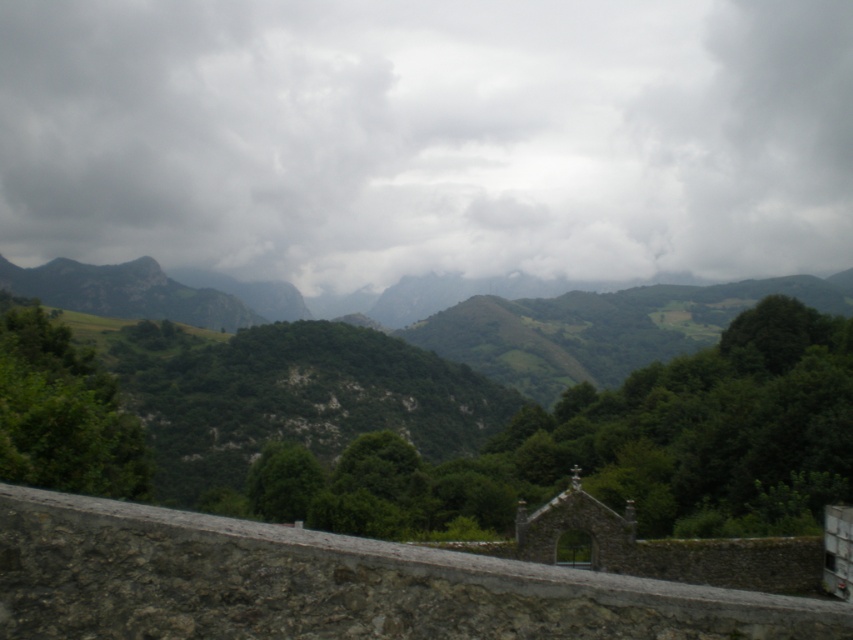
Does cloudy sky at upper center have a larger size compared to gray stone wall at lower center?

Indeed, cloudy sky at upper center has a larger size compared to gray stone wall at lower center.

Which is behind, point (775, 262) or point (230, 522)?

Point (775, 262)

The height and width of the screenshot is (640, 853). In order to click on cloudy sky at upper center in this screenshot , I will do `click(428, 138)`.